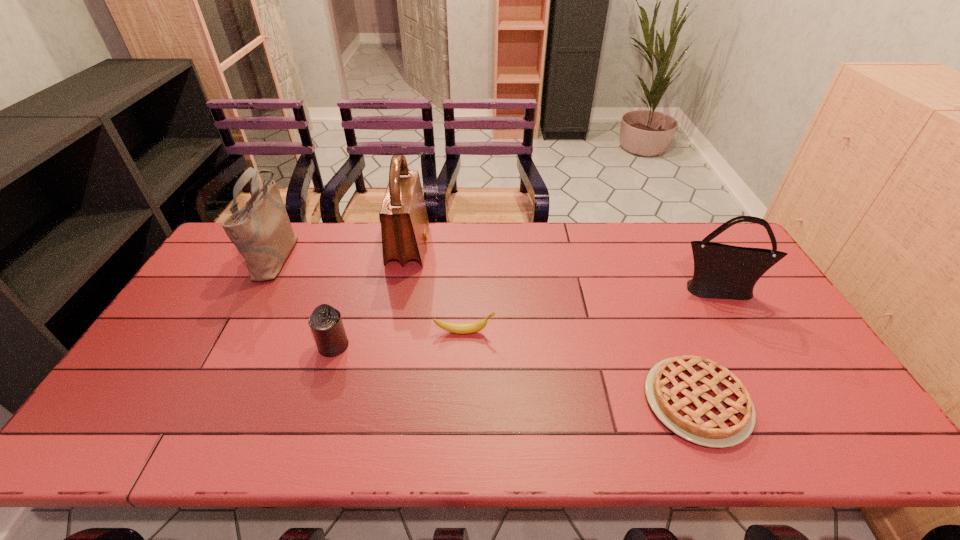
At what (x,y) coordinates should I click in order to perform the action: click on blank space located on the front flap of the second shoulder bag from left to right. Please return your answer as a coordinate pair (x, y). Image resolution: width=960 pixels, height=540 pixels. Looking at the image, I should click on (448, 246).

I want to click on vacant space positioned 0.290m on the front-facing side of the leftmost shoulder bag, so click(382, 255).

You are a GUI agent. You are given a task and a screenshot of the screen. Output one action in this format:
    pyautogui.click(x=<x>, y=<y>)
    Task: Click on the vacant area located on the front of the shortest shoulder bag
    
    Given the screenshot: What is the action you would take?
    pyautogui.click(x=776, y=392)

Image resolution: width=960 pixels, height=540 pixels. Identify the location of free space located 0.150m on the front of the fourth tallest object. (314, 408).

The height and width of the screenshot is (540, 960). Find the location of `vacant space situated at the stem of the banana`. vacant space situated at the stem of the banana is located at coordinates (566, 332).

Locate an element on the screen. vacant space located 0.320m on the left of the shortest object is located at coordinates (514, 401).

The width and height of the screenshot is (960, 540). In order to click on object that is at the near edge in this screenshot , I will do `click(698, 399)`.

Find the location of a particular element. This screenshot has height=540, width=960. object that is at the left edge is located at coordinates (261, 230).

The width and height of the screenshot is (960, 540). I want to click on object at the right edge, so click(721, 271).

You are a GUI agent. You are given a task and a screenshot of the screen. Output one action in this format:
    pyautogui.click(x=<x>, y=<y>)
    Task: Click on the object that is at the far left corner
    This screenshot has height=540, width=960.
    Given the screenshot: What is the action you would take?
    pyautogui.click(x=261, y=230)